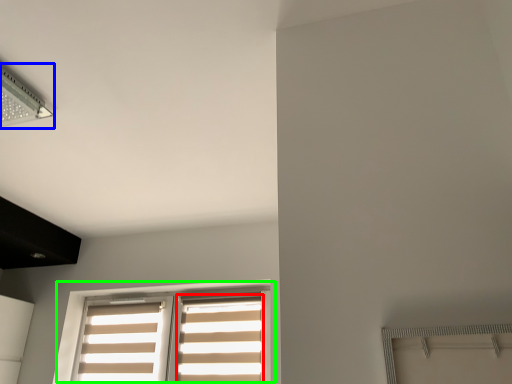
Question: Based on their relative distances, which object is farther from curtain (highlighted by a red box)? Choose from lamp (highlighted by a blue box) and window (highlighted by a green box).

Choices:
 (A) lamp
 (B) window

Answer: (A)